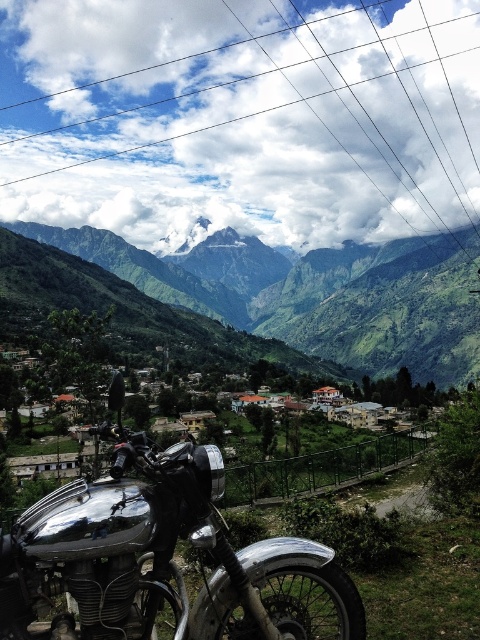
Can you confirm if metallic wire at upper center is thinner than green grassy mountain at upper center?

No, metallic wire at upper center is not thinner than green grassy mountain at upper center.

Is metallic wire at upper center to the right of green grassy mountain at upper center from the viewer's perspective?

Indeed, metallic wire at upper center is positioned on the right side of green grassy mountain at upper center.

The height and width of the screenshot is (640, 480). I want to click on metallic wire at upper center, so click(241, 118).

Does metallic wire at upper center have a lesser width compared to polished chrome motorcycle at center?

No, metallic wire at upper center is not thinner than polished chrome motorcycle at center.

Which is in front, point (76, 52) or point (64, 628)?

Point (64, 628) is more forward.

Locate an element on the screen. The height and width of the screenshot is (640, 480). metallic wire at upper center is located at coordinates (241, 118).

Does polished chrome motorcycle at center have a greater height compared to green grassy mountain at upper center?

No.

Where is `polished chrome motorcycle at center`? polished chrome motorcycle at center is located at coordinates (162, 557).